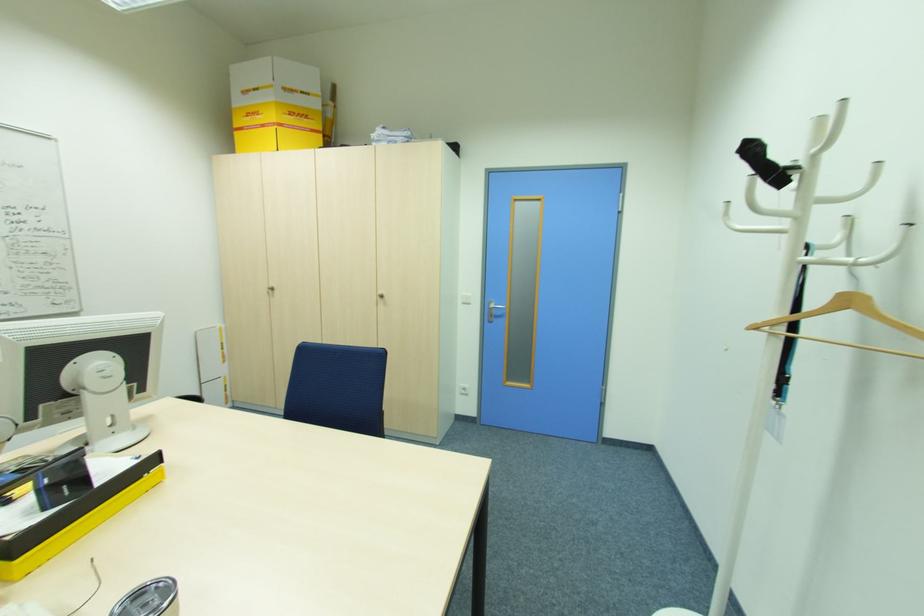
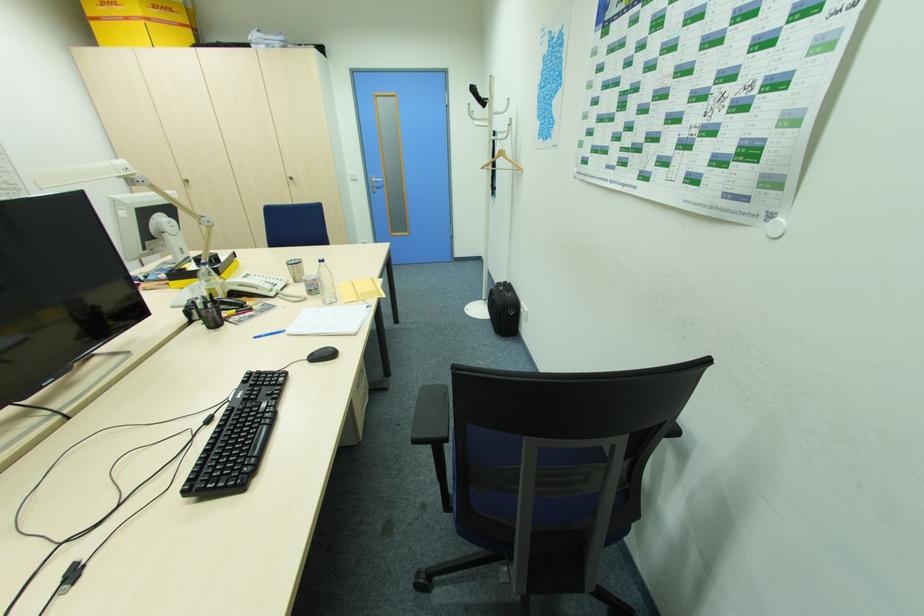
Where in the second image is the point corresponding to point 759,326 from the first image?

(485, 168)